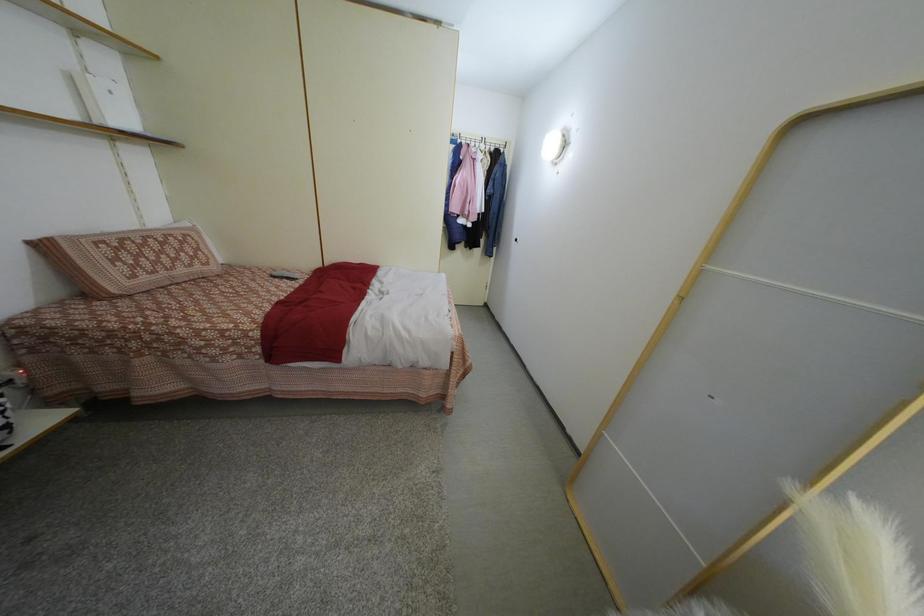
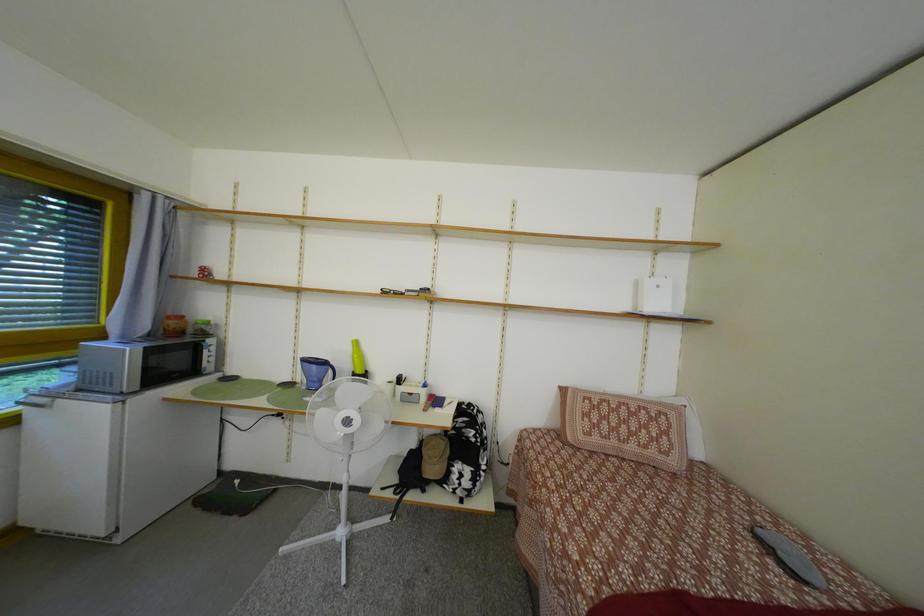
Question: The first image is from the beginning of the video and the second image is from the end. How did the camera likely rotate when shooting the video?

Choices:
 (A) Left
 (B) Right
 (C) Up
 (D) Down

Answer: (A)